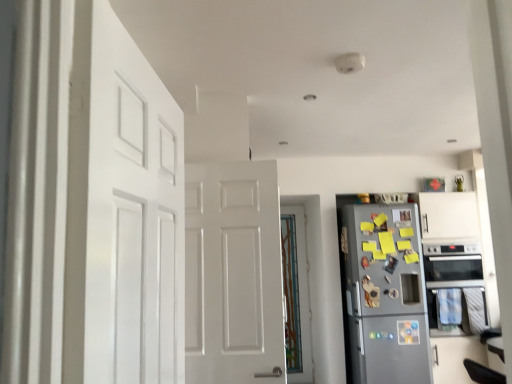
Question: From the image's perspective, is white matte door at left, the second door positioned from the right, located above or below metallic gray refrigerator at right?

Choices:
 (A) below
 (B) above

Answer: (B)

Question: Visually, is white matte door at left, the first door in the front-to-back sequence, positioned to the left or to the right of metallic gray refrigerator at right?

Choices:
 (A) right
 (B) left

Answer: (B)

Question: Which object is the closest to the white matte door at left, the second door positioned from the right?

Choices:
 (A) black glass oven at right
 (B) metallic gray refrigerator at right
 (C) translucent glass door at center, marked as the second door in a front-to-back arrangement

Answer: (B)

Question: Considering the real-world distances, which object is closest to the metallic gray refrigerator at right?

Choices:
 (A) translucent glass door at center, marked as the second door in a front-to-back arrangement
 (B) black glass oven at right
 (C) white matte door at left, the second door positioned from the right

Answer: (B)